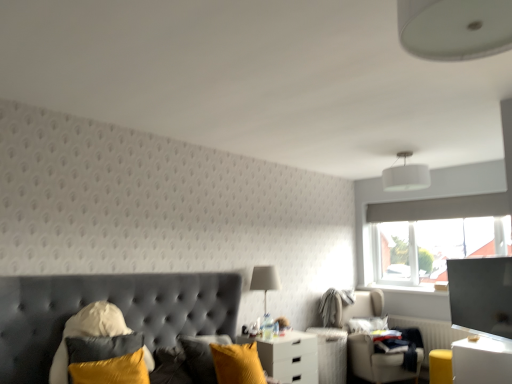
Question: Does velvet yellow pillow at lower left, which is the 1th pillow from front to back, have a larger size compared to white glossy nightstand at lower right, which is the second nightstand in back-to-front order?

Choices:
 (A) no
 (B) yes

Answer: (A)

Question: From a real-world perspective, is velvet yellow pillow at lower left, positioned as the first pillow in top-to-bottom order, positioned under white glossy nightstand at lower right, the 1th nightstand positioned from the right, based on gravity?

Choices:
 (A) yes
 (B) no

Answer: (B)

Question: From a real-world perspective, is velvet yellow pillow at lower left, the 2th pillow in the back-to-front sequence, physically above white glossy nightstand at lower right, which is the second nightstand in back-to-front order?

Choices:
 (A) no
 (B) yes

Answer: (B)

Question: Is velvet yellow pillow at lower left, which is the 1th pillow from left to right, shorter than white glossy nightstand at lower right, which is the second nightstand in back-to-front order?

Choices:
 (A) yes
 (B) no

Answer: (A)

Question: Is velvet yellow pillow at lower left, positioned as the first pillow in top-to-bottom order, facing towards white glossy nightstand at lower right, which is the second nightstand in back-to-front order?

Choices:
 (A) yes
 (B) no

Answer: (B)

Question: From their relative heights in the image, would you say matte white table lamp at center is taller or shorter than soft white pillow at lower right, which appears as the 1th pillow when viewed from the right?

Choices:
 (A) tall
 (B) short

Answer: (A)

Question: From a real-world perspective, is matte white table lamp at center physically located above or below soft white pillow at lower right, which appears as the 1th pillow when viewed from the right?

Choices:
 (A) below
 (B) above

Answer: (B)

Question: Based on their positions, is matte white table lamp at center located to the left or right of soft white pillow at lower right, acting as the second pillow starting from the front?

Choices:
 (A) left
 (B) right

Answer: (A)

Question: Considering their positions, is matte white table lamp at center located in front of or behind soft white pillow at lower right, acting as the second pillow starting from the front?

Choices:
 (A) front
 (B) behind

Answer: (A)

Question: Relative to white fabric lampshade at upper center, is velvet yellow pillow at lower left, the 2th pillow when ordered from right to left, in front or behind?

Choices:
 (A) behind
 (B) front

Answer: (B)

Question: Is velvet yellow pillow at lower left, positioned as the first pillow in top-to-bottom order, to the left or to the right of white fabric lampshade at upper center in the image?

Choices:
 (A) right
 (B) left

Answer: (B)

Question: Is point (103, 379) closer or farther from the camera than point (414, 185)?

Choices:
 (A) farther
 (B) closer

Answer: (B)

Question: Considering the positions of velvet yellow pillow at lower left, the 2th pillow in the back-to-front sequence, and white fabric lampshade at upper center in the image, is velvet yellow pillow at lower left, the 2th pillow in the back-to-front sequence, taller or shorter than white fabric lampshade at upper center?

Choices:
 (A) short
 (B) tall

Answer: (A)

Question: From a real-world perspective, relative to matte white table lamp at center, is white glossy nightstand at center, positioned as the 1th nightstand in left-to-right order, vertically above or below?

Choices:
 (A) above
 (B) below

Answer: (B)

Question: Considering the positions of point (264, 344) and point (260, 266), is point (264, 344) closer or farther from the camera than point (260, 266)?

Choices:
 (A) closer
 (B) farther

Answer: (A)